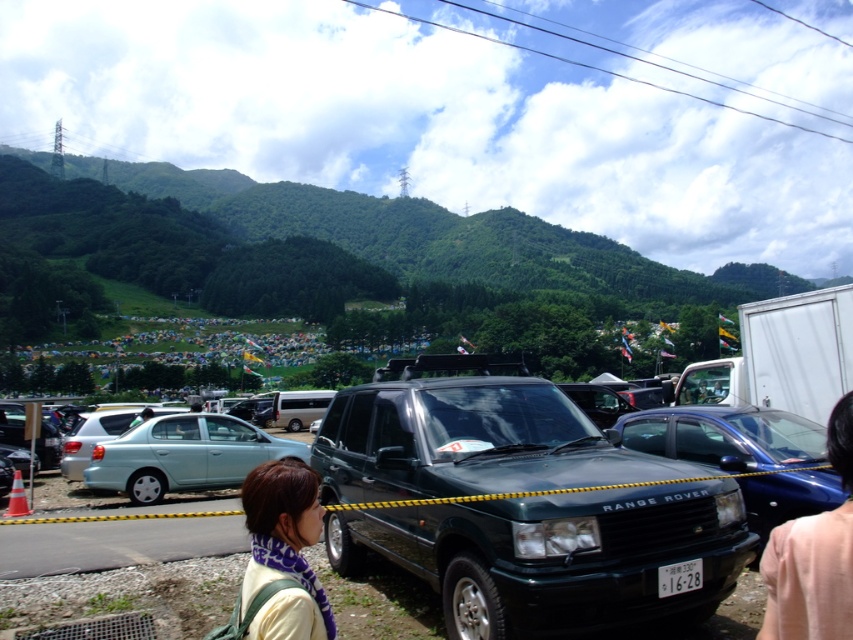
You are standing at the center of the parking area and want to find the light blue metallic sedan at left. According to the coordinates provided, in which direction should you look to locate it?

The light blue metallic sedan at left is located at point coordinates (183, 456), which means it is positioned to the left side of the scene. Therefore, you should look to your left to find it.

You are a photographer trying to capture a closeup of the smooth skin at lower right and the light yellow fabric at center. Which object should you focus on first if you want to ensure both are in the same frame?

The smooth skin at lower right is positioned on the right side of light yellow fabric at center, so you should focus on the light yellow fabric at center first to ensure both are in the same frame.